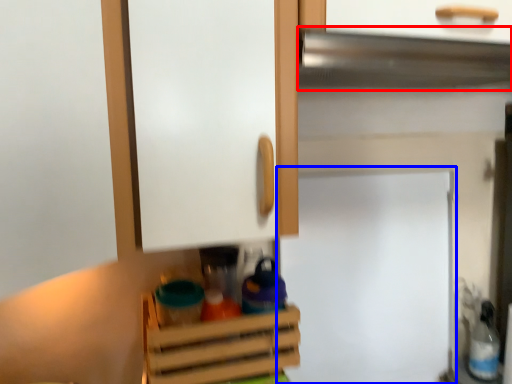
Question: Which of the following is the closest to the observer, exhaust hood (highlighted by a red box) or fridge (highlighted by a blue box)?

Choices:
 (A) exhaust hood
 (B) fridge

Answer: (A)